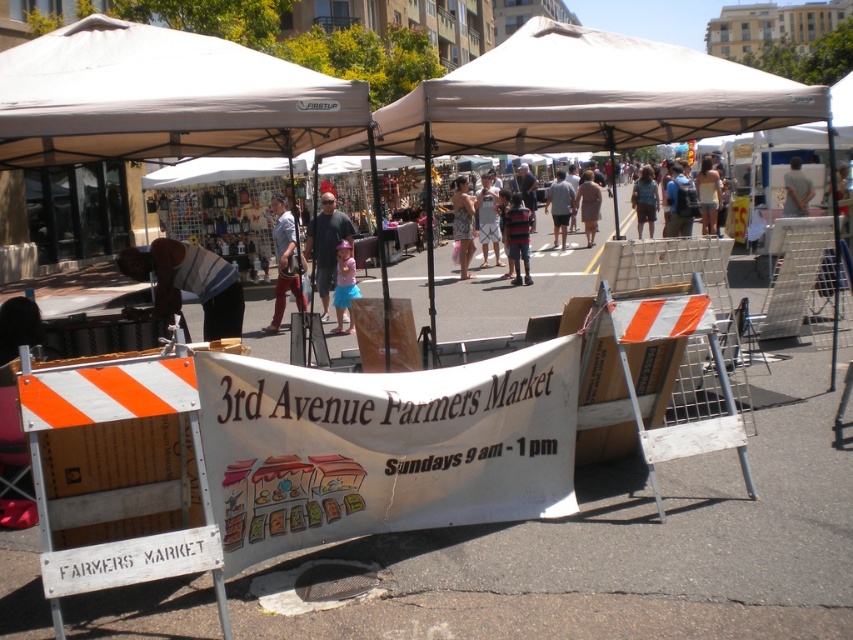
You are a vendor at the 3rd Avenue Farmers Market and need to move your blue fabric backpack at center and light brown fabric dress at center to a new location 4 meters away. Can you carry both items at the same time without dropping them?

The blue fabric backpack at center and light brown fabric dress at center are 3.45 meters apart. Since the new location is 4 meters away, you can carry both items at the same time as the distance between them is manageable and within your reach.

You are standing in the farmers market and see the beige fabric canopy at upper center and the blue fabric backpack at center. Which object is positioned higher relative to the other?

The beige fabric canopy at upper center is located above the blue fabric backpack at center, so it is higher.

From the picture: You are setting up a stall at the 3rd Avenue Farmers Market and need to choose between the white fabric canopy at upper left and the beige fabric canopy at upper center. Which canopy would provide more shade coverage for your stall?

The beige fabric canopy at upper center is larger than the white fabric canopy at upper left, so it would provide more shade coverage for your stall.